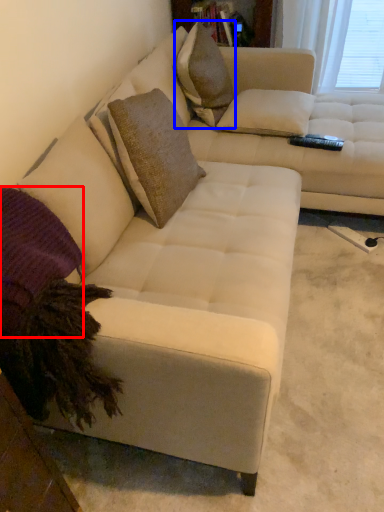
Question: Which of the following is the farthest to the observer, pillow (highlighted by a red box) or throw pillow (highlighted by a blue box)?

Choices:
 (A) pillow
 (B) throw pillow

Answer: (B)